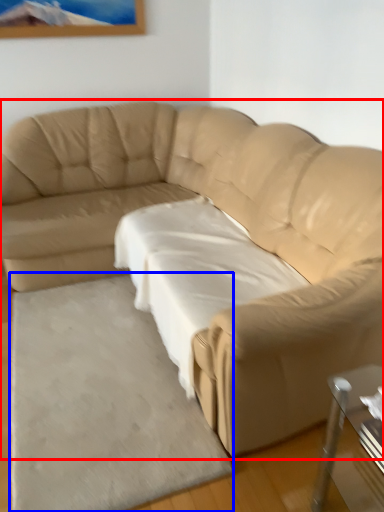
Question: Among these objects, which one is nearest to the camera, studio couch (highlighted by a red box) or mat (highlighted by a blue box)?

Choices:
 (A) studio couch
 (B) mat

Answer: (A)